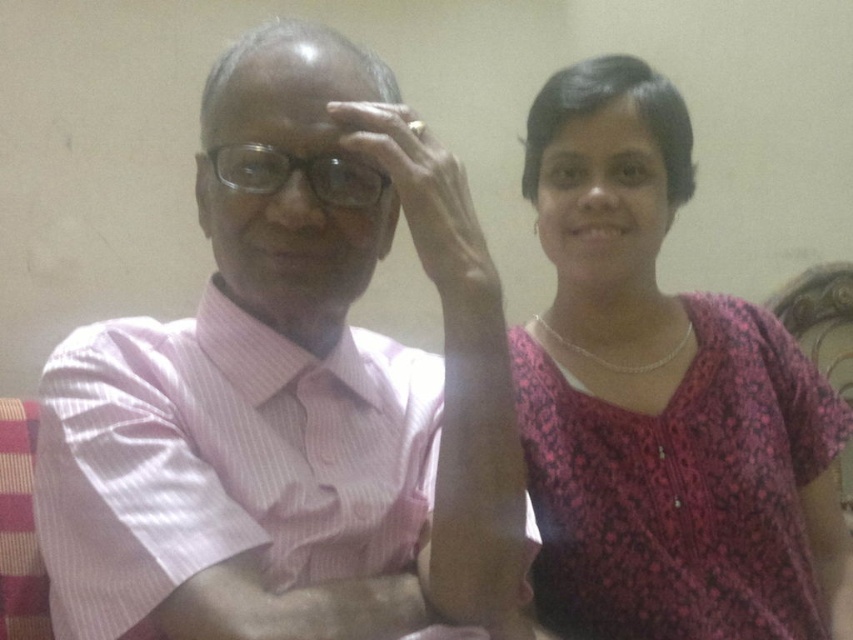
You are a photographer setting up a portrait session. You have to decide where to place a small decorative item that needs to be visible but not too prominent. The item must be placed either below the pink striped shirt at left or above the transparent plastic glasses at center. Which placement would make the item less noticeable?

The item should be placed below the pink striped shirt at left because it is shorter than the transparent plastic glasses at center, making it less noticeable there.

You are a photographer setting up a shot of two people sitting together. The man on the left is wearing a pink striped shirt. You need to place a microphone exactly at the midpoint between the pink striped shirt at left and the woman on the right. What are the coordinates of this midpoint?

The midpoint between the pink striped shirt at left and the woman on the right would be calculated by averaging their coordinates. Since the pink striped shirt at left is at point (293, 401), and the woman on the right is at an unknown coordinate, we cannot determine the exact midpoint without her position. However, based on the given information, the microphone should be placed at the average of their x and y coordinates.

Looking at this image, you are standing in the room where the two individuals are seated. You need to place a small gift box exactly at point (663, 400). According to the image, what object will the gift box be placed on top of?

The pink floral dress at right will be where the gift box is placed since the Objects Description states that at point (663, 400) lies the pink floral dress at right.